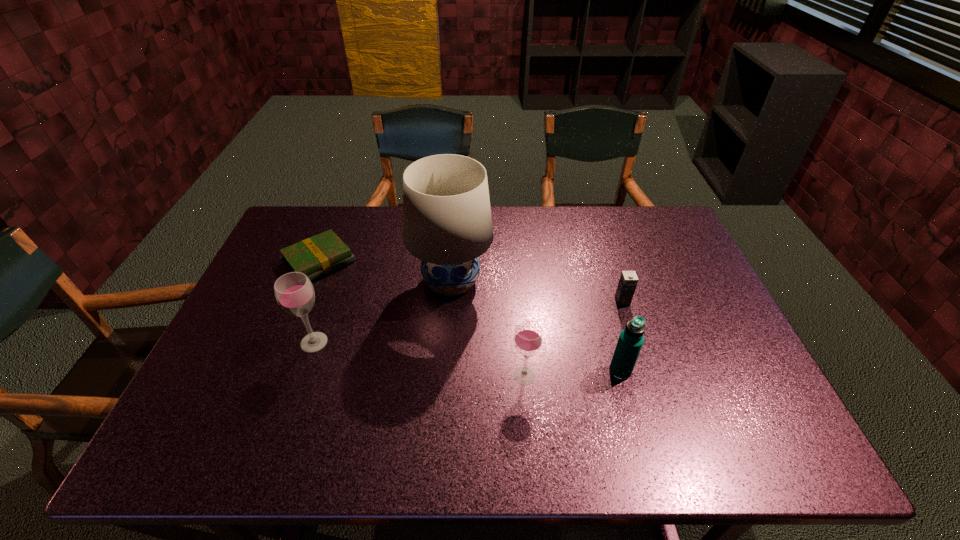
In the image, there is a desktop. Identify the location of blank space at the far edge. (372, 223).

Locate an element on the screen. free space at the near edge of the desktop is located at coordinates (614, 383).

Image resolution: width=960 pixels, height=540 pixels. In the image, there is a desktop. In order to click on vacant area at the left edge in this screenshot , I will do `click(257, 310)`.

In the image, there is a desktop. Where is `vacant space at the right edge`? The height and width of the screenshot is (540, 960). vacant space at the right edge is located at coordinates (720, 346).

Where is `vacant space at the far left corner of the desktop`? This screenshot has width=960, height=540. vacant space at the far left corner of the desktop is located at coordinates (315, 227).

At what (x,y) coordinates should I click in order to perform the action: click on vacant space at the far right corner of the desktop. Please return your answer as a coordinate pair (x, y). This screenshot has height=540, width=960. Looking at the image, I should click on (647, 212).

Where is `vacant point located between the third object from left to right and the chocolate milk`? vacant point located between the third object from left to right and the chocolate milk is located at coordinates (537, 292).

Find the location of a particular element. The image size is (960, 540). free space between the second shortest object and the fifth shortest object is located at coordinates (468, 322).

What are the coordinates of `free area in between the tallest object and the rightmost object` in the screenshot? It's located at (537, 292).

Locate an element on the screen. free space between the shortest object and the fifth object from left to right is located at coordinates (469, 316).